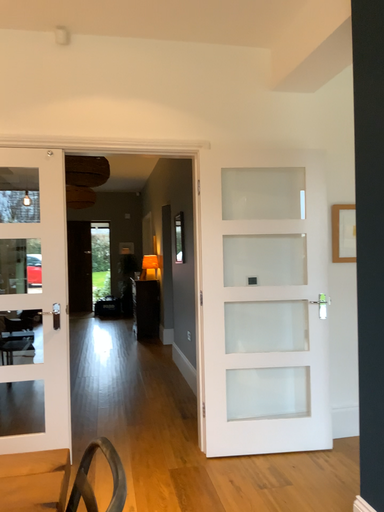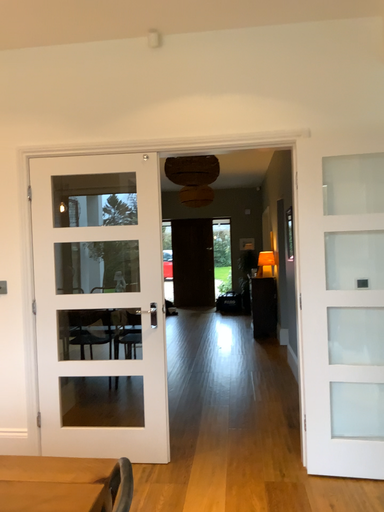
Question: How did the camera likely rotate when shooting the video?

Choices:
 (A) rotated right
 (B) rotated left

Answer: (B)